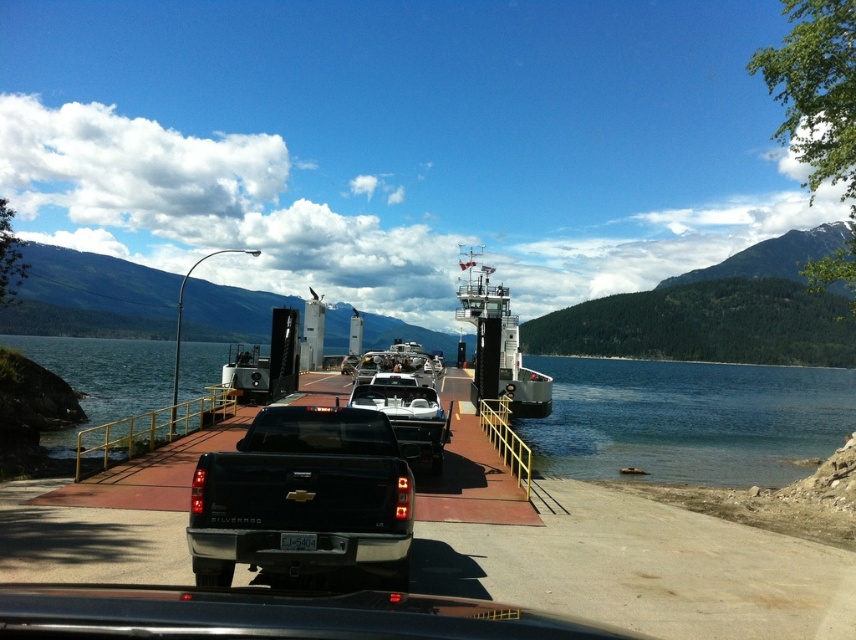
Between metallic gray boat at center and metallic silver boat at center, which one is positioned lower?

metallic silver boat at center

Who is taller, metallic gray boat at center or metallic silver boat at center?

Standing taller between the two is metallic gray boat at center.

Is point (531, 376) in front of point (389, 396)?

That is False.

Where is `metallic gray boat at center`? This screenshot has width=856, height=640. metallic gray boat at center is located at coordinates (498, 346).

Can you confirm if clear blue water at center is positioned above metallic silver boat at center?

No, clear blue water at center is not above metallic silver boat at center.

Does clear blue water at center have a lesser height compared to metallic silver boat at center?

Incorrect, clear blue water at center's height does not fall short of metallic silver boat at center's.

Is point (84, 372) less distant than point (443, 440)?

No.

Identify the location of clear blue water at center. The width and height of the screenshot is (856, 640). (100, 378).

Can you confirm if clear water at center is bigger than metallic gray boat at center?

Yes.

Is point (583, 372) positioned behind point (531, 403)?

Yes, it is behind point (531, 403).

What do you see at coordinates (688, 419) in the screenshot? This screenshot has width=856, height=640. I see `clear water at center` at bounding box center [688, 419].

Locate an element on the screen. This screenshot has height=640, width=856. clear water at center is located at coordinates (688, 419).